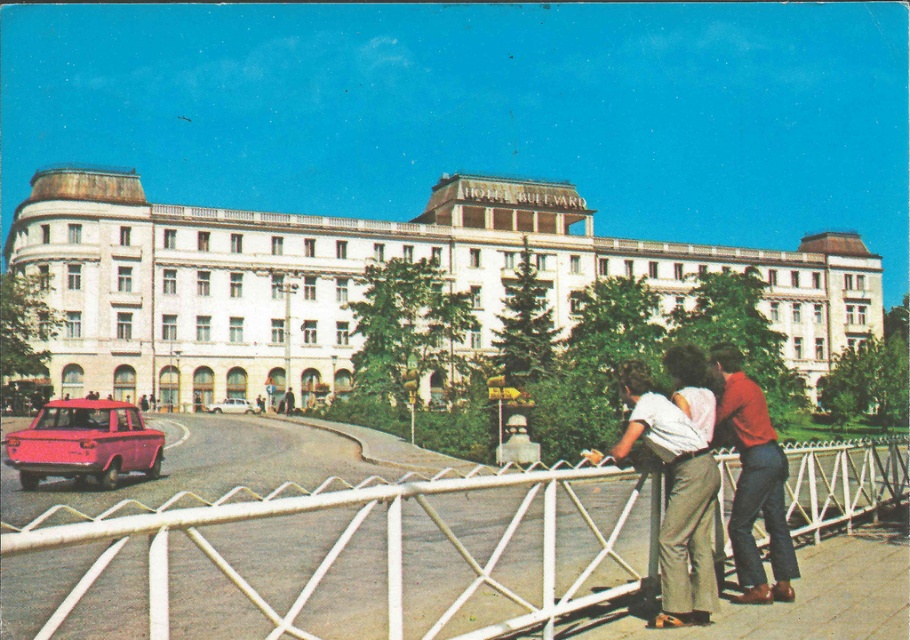
Question: Which object is positioned closest to the white metal fence at lower center?

Choices:
 (A) white glossy sedan at center
 (B) red cotton shirt at lower right

Answer: (B)

Question: Which of the following is the closest to the observer?

Choices:
 (A) white metal fence at lower center
 (B) matte pink sedan at lower left
 (C) white glossy sedan at center
 (D) matte white pants at center

Answer: (A)

Question: Among these points, which one is nearest to the camera?

Choices:
 (A) (537, 524)
 (B) (625, 396)
 (C) (747, 548)

Answer: (C)

Question: Does red cotton shirt at lower right appear under matte pink sedan at lower left?

Choices:
 (A) no
 (B) yes

Answer: (A)

Question: In this image, where is matte pink sedan at lower left located relative to white glossy sedan at center?

Choices:
 (A) below
 (B) above

Answer: (A)

Question: Can you confirm if matte white pants at center is positioned below red cotton shirt at lower right?

Choices:
 (A) no
 (B) yes

Answer: (B)